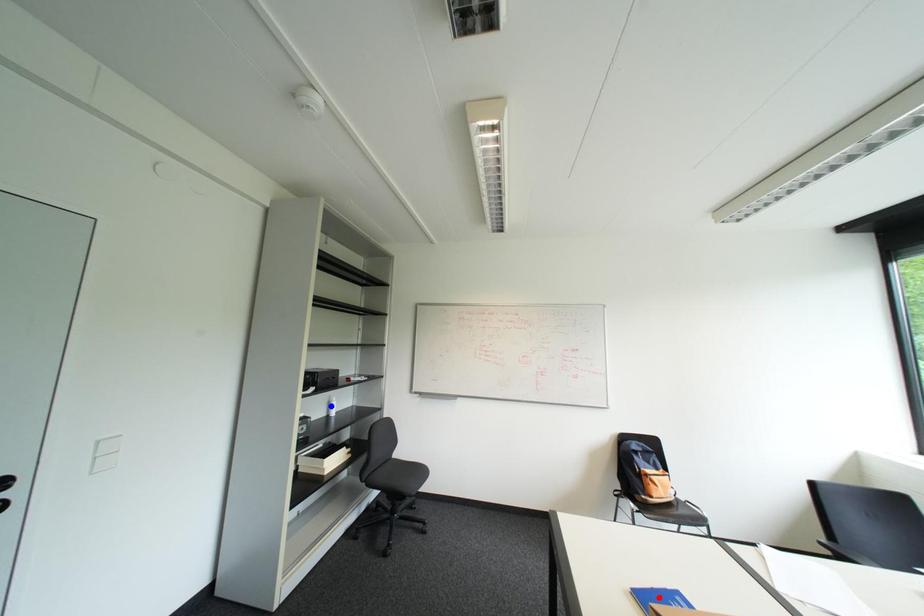
Question: In the image, two points are highlighted. Which point is nearer to the camera? Reply with the corresponding letter.

Choices:
 (A) blue point
 (B) red point

Answer: (B)